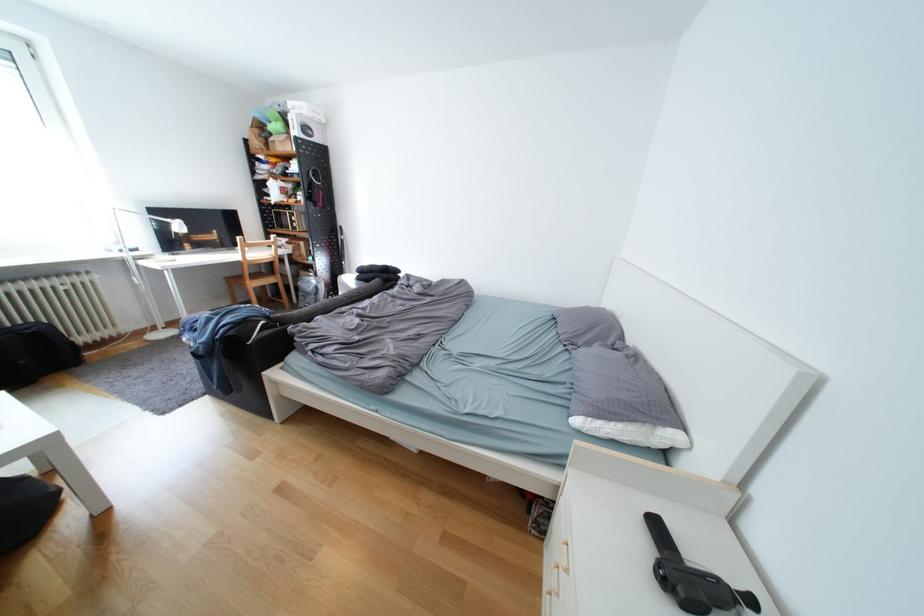
The height and width of the screenshot is (616, 924). Find the location of `white lamp head`. white lamp head is located at coordinates (310, 290).